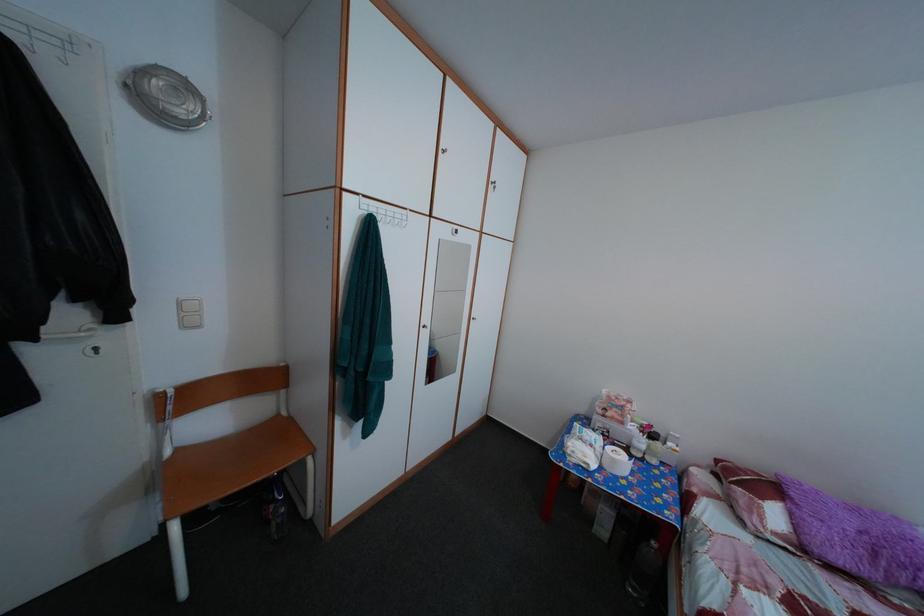
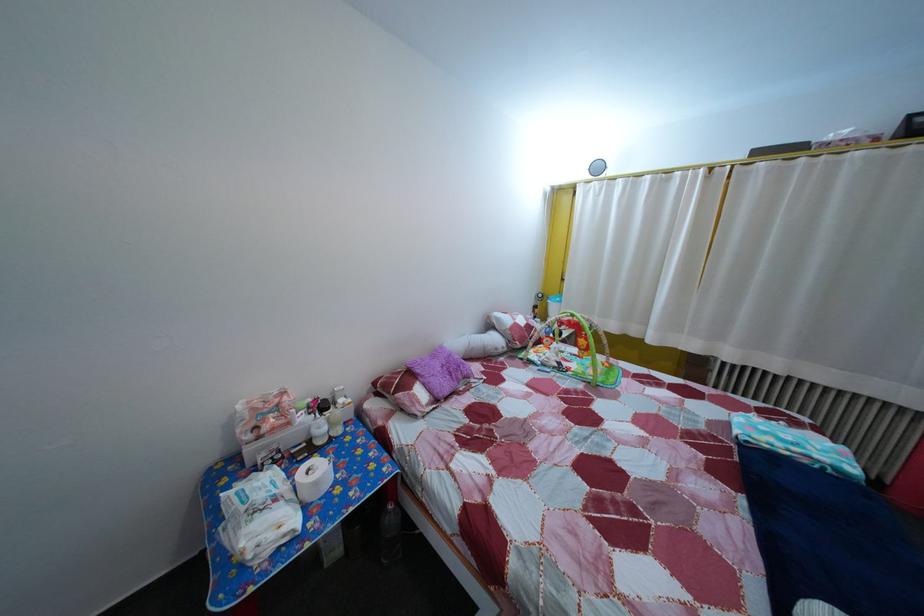
Locate, in the second image, the point that corresponds to (x=601, y=454) in the first image.

(285, 508)